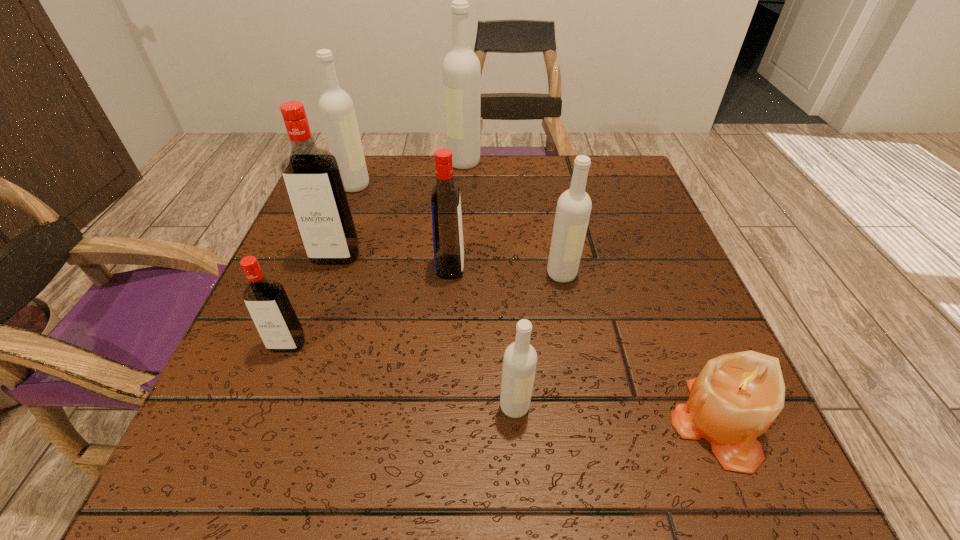
Identify the location of the second white vodka from left to right. This screenshot has height=540, width=960. (461, 68).

This screenshot has height=540, width=960. Find the location of `the farthest white vodka`. the farthest white vodka is located at coordinates (461, 68).

Identify the location of the third nearest white vodka. The width and height of the screenshot is (960, 540). (336, 107).

Where is `the third smallest white vodka`? This screenshot has height=540, width=960. the third smallest white vodka is located at coordinates (336, 107).

Where is `the biggest red vodka`? This screenshot has width=960, height=540. the biggest red vodka is located at coordinates (311, 175).

Identify the location of the rightmost white vodka. The image size is (960, 540). (573, 210).

Where is `the second smallest white vodka`? The image size is (960, 540). the second smallest white vodka is located at coordinates (573, 210).

Locate an element on the screen. This screenshot has width=960, height=540. the rightmost red vodka is located at coordinates (448, 245).

Locate an element on the screen. This screenshot has width=960, height=540. the third nearest object is located at coordinates (266, 300).

Locate an element on the screen. The height and width of the screenshot is (540, 960). the smallest red vodka is located at coordinates (266, 300).